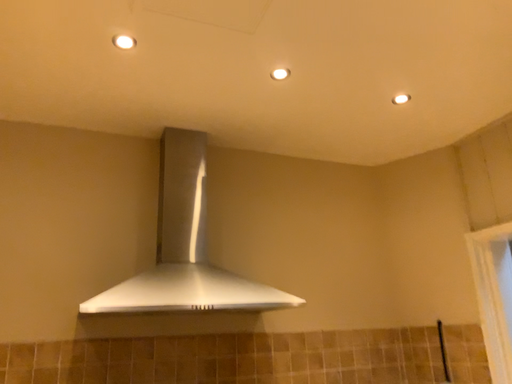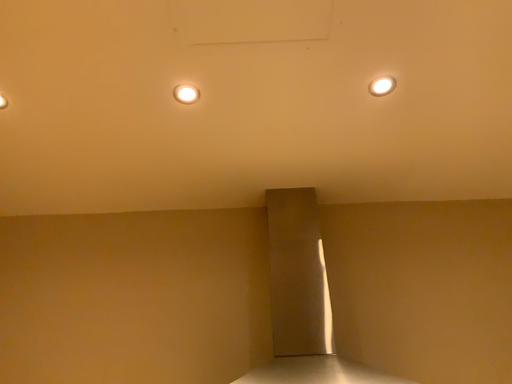
Question: Which way did the camera rotate in the video?

Choices:
 (A) rotated left
 (B) rotated right

Answer: (A)